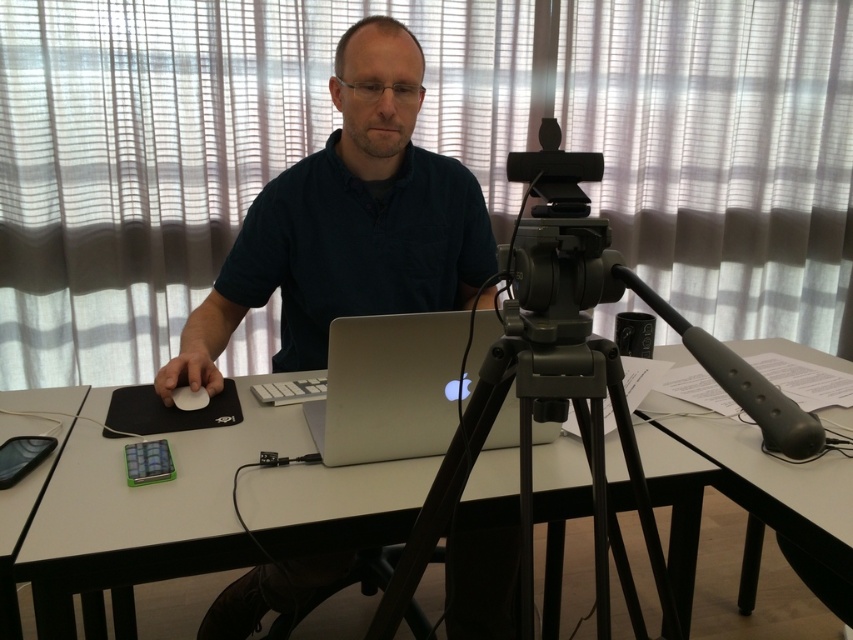
Question: Is white glossy table at center closer to camera compared to matte black tripod at center?

Choices:
 (A) yes
 (B) no

Answer: (B)

Question: Which object appears farthest from the camera in this image?

Choices:
 (A) white paper at upper right
 (B) dark blue shirt at center
 (C) matte black tripod at center
 (D) white glossy table at center

Answer: (B)

Question: Which object is closer to the camera taking this photo?

Choices:
 (A) matte black tripod at center
 (B) white paper at upper right

Answer: (A)

Question: Is dark blue shirt at center wider than matte black tripod at center?

Choices:
 (A) yes
 (B) no

Answer: (A)

Question: Can you confirm if silver metallic laptop at center is smaller than white matte mouse at left?

Choices:
 (A) no
 (B) yes

Answer: (A)

Question: Which is farther from the dark blue shirt at center?

Choices:
 (A) white matte mouse at left
 (B) silver metallic laptop at center

Answer: (A)